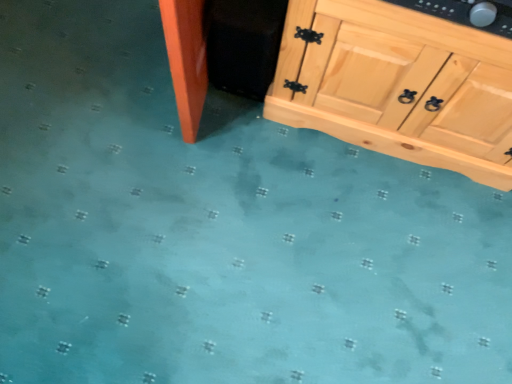
I want to click on natural wood cabinet at upper right, so click(x=399, y=85).

Describe the element at coordinates (399, 85) in the screenshot. I see `natural wood cabinet at upper right` at that location.

I want to click on natural wood cabinet at upper right, so click(x=399, y=85).